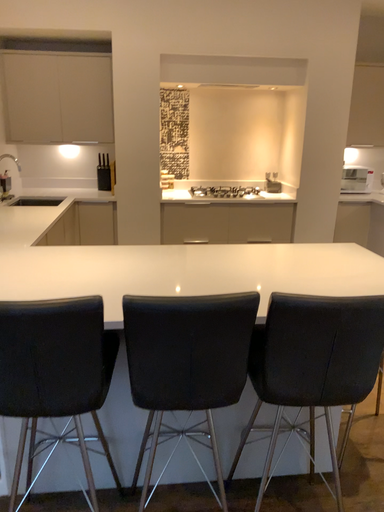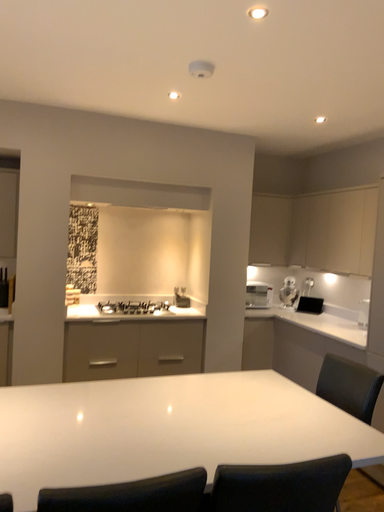
Question: Which way did the camera rotate in the video?

Choices:
 (A) rotated left
 (B) rotated right

Answer: (B)